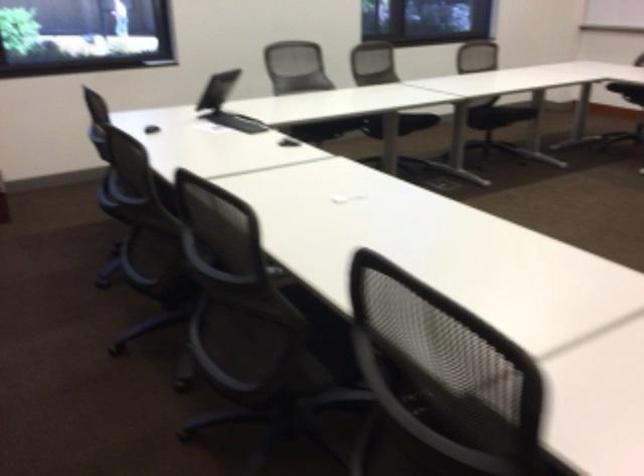
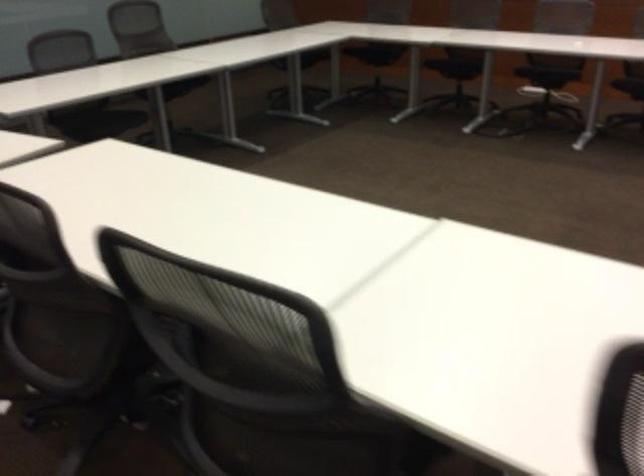
How did the camera likely rotate?

The camera's rotation is toward right-down.